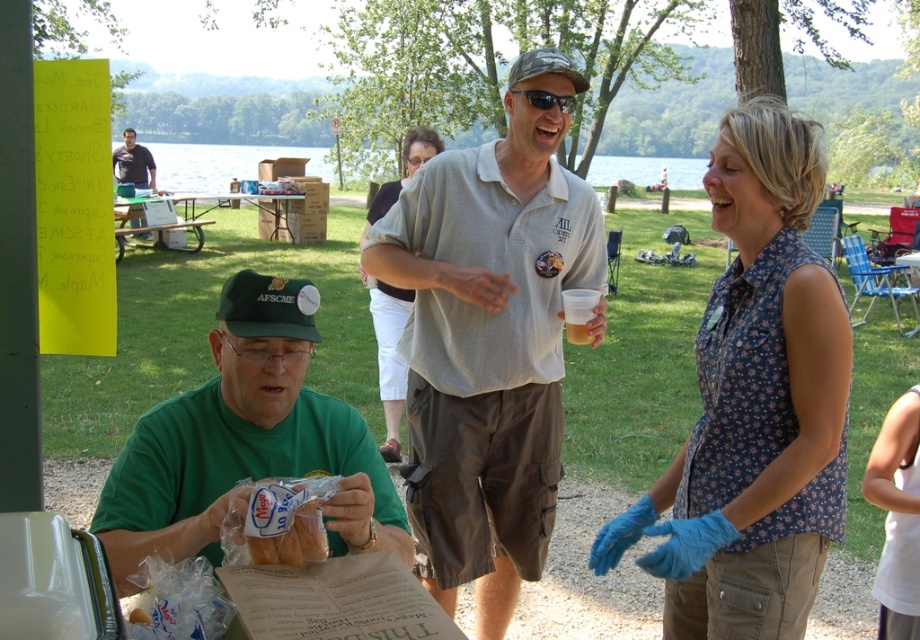
Is light beige cotton pants at center positioned at the back of dark gray shirt at upper left?

No.

Does light beige cotton pants at center have a larger size compared to dark gray shirt at upper left?

No, light beige cotton pants at center is not bigger than dark gray shirt at upper left.

Which is in front, point (391, 307) or point (122, 172)?

Positioned in front is point (391, 307).

Image resolution: width=920 pixels, height=640 pixels. What are the coordinates of `light beige cotton pants at center` in the screenshot? It's located at (389, 355).

Does dark gray shirt at upper left come in front of translucent plastic cup at center?

No, it is behind translucent plastic cup at center.

Between point (138, 220) and point (566, 317), which one is positioned behind?

The point (138, 220) is behind.

Locate an element on the screen. The width and height of the screenshot is (920, 640). dark gray shirt at upper left is located at coordinates (133, 163).

Identify the location of floral print shirt at center. (754, 404).

Between floral print shirt at center and wooden picnic table at center, which one has less height?

Standing shorter between the two is wooden picnic table at center.

Is point (721, 292) closer to camera compared to point (273, 216)?

Yes, point (721, 292) is in front of point (273, 216).

The height and width of the screenshot is (640, 920). I want to click on floral print shirt at center, so click(754, 404).